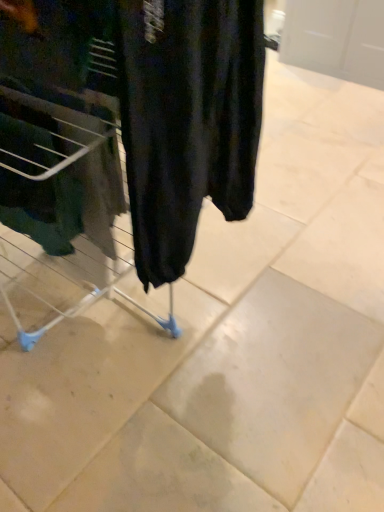
Question: Looking at their shapes, would you say metal laundry basket at left is wider or thinner than black matte pants at center?

Choices:
 (A) wide
 (B) thin

Answer: (A)

Question: Considering the positions of point (28, 105) and point (158, 124), is point (28, 105) closer or farther from the camera than point (158, 124)?

Choices:
 (A) closer
 (B) farther

Answer: (B)

Question: Looking at the image, does metal laundry basket at left seem bigger or smaller compared to black matte pants at center?

Choices:
 (A) big
 (B) small

Answer: (B)

Question: Considering their positions, is black matte pants at center located in front of or behind metal laundry basket at left?

Choices:
 (A) behind
 (B) front

Answer: (B)

Question: Is black matte pants at center taller or shorter than metal laundry basket at left?

Choices:
 (A) short
 (B) tall

Answer: (B)

Question: Would you say black matte pants at center is inside or outside metal laundry basket at left?

Choices:
 (A) inside
 (B) outside

Answer: (B)

Question: From a real-world perspective, is black matte pants at center above or below metal laundry basket at left?

Choices:
 (A) above
 (B) below

Answer: (A)